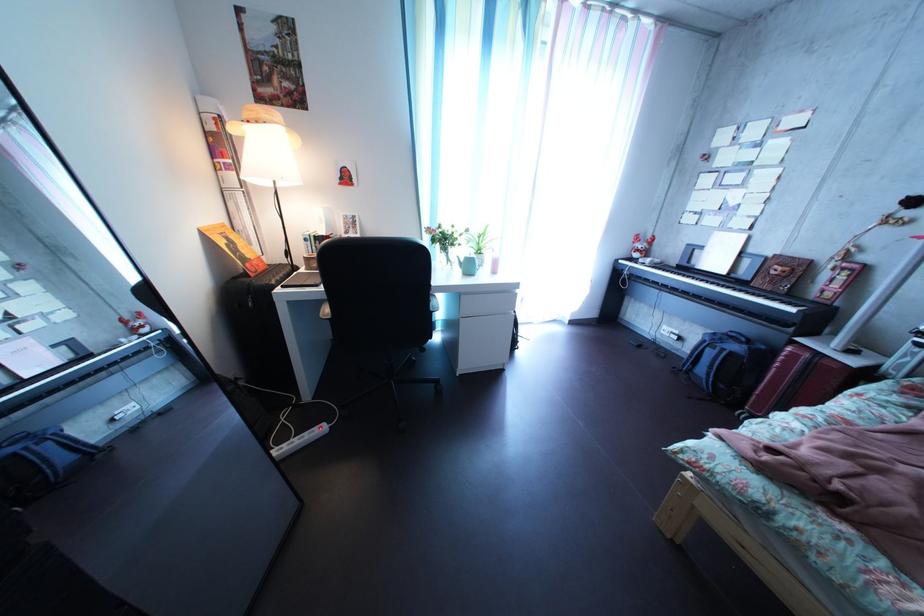
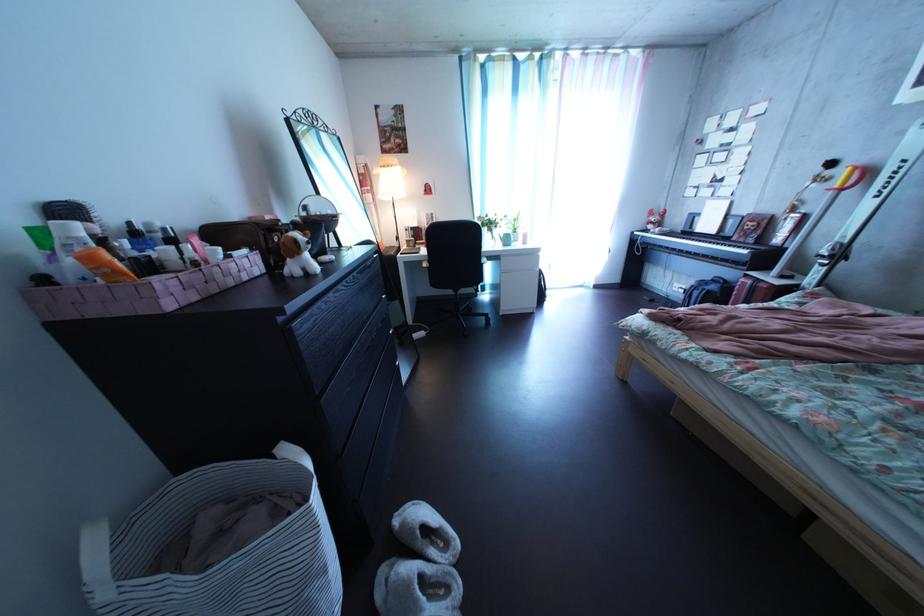
Question: The camera is either moving clockwise (left) or counter-clockwise (right) around the object. The first image is from the beginning of the video and the second image is from the end. Is the camera moving left or right when shooting the video?

Choices:
 (A) Left
 (B) Right

Answer: (B)